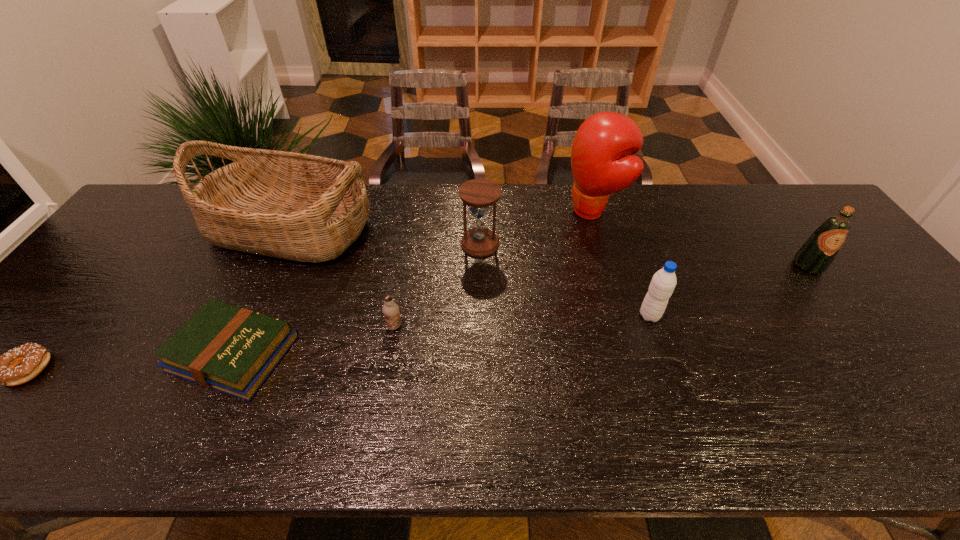
Identify the location of free space between the tallest object and the rightmost object. (701, 238).

Where is `empty space between the third shortest object and the water bottle`? empty space between the third shortest object and the water bottle is located at coordinates (522, 321).

Where is `vacant area that lies between the book and the fourth object from left to right`? vacant area that lies between the book and the fourth object from left to right is located at coordinates (314, 340).

The image size is (960, 540). What are the coordinates of `empty space between the rightmost object and the water bottle` in the screenshot? It's located at (729, 291).

I want to click on object that is the third nearest to the leftmost object, so click(x=390, y=309).

Locate which object ranks fourth in proximity to the hourglass. Please provide its 2D coordinates. Your answer should be formatted as a tuple, i.e. [(x, y)], where the tuple contains the x and y coordinates of a point satisfying the conditions above.

[(662, 285)]